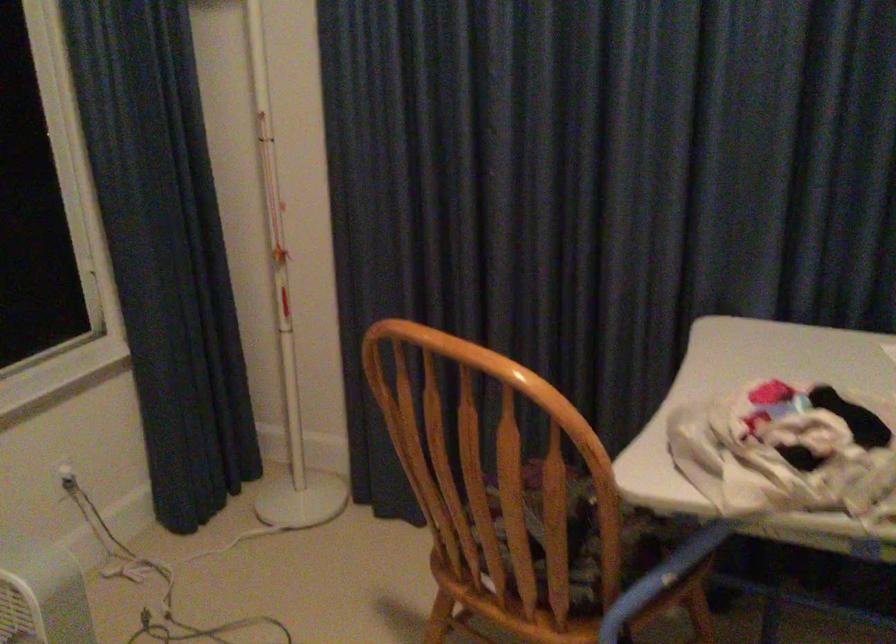
At what (x,y) coordinates should I click in order to perform the action: click on white electrical plug. Please return your answer as a coordinate pair (x, y). This screenshot has width=896, height=644. Looking at the image, I should click on (65, 478).